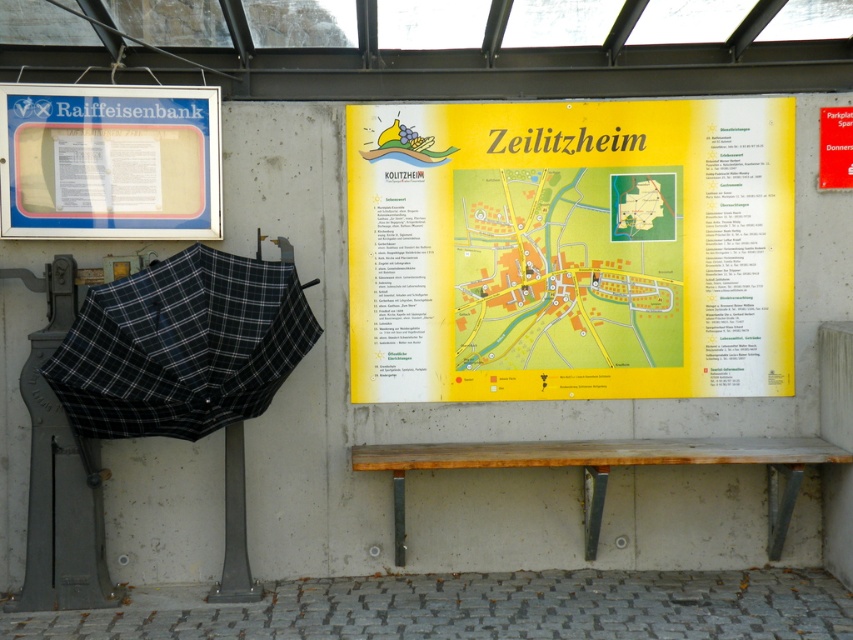
You are standing at the bus stop and need to locate the yellow paper map at upper center and the yellow paper map at center. Which one is higher up?

The yellow paper map at upper center is much taller than the yellow paper map at center, so it is higher up.

You are a tourist holding a yellow paper map at center and want to sit down to consult it. Is the wooden bench at lower center positioned in a way that allows you to sit and still see the map clearly?

The yellow paper map at center is located above the wooden bench at lower center, so you can sit on the bench and easily view the map above you.

You are standing at the bus stop and want to know which point is closer to you. The points are labeled as point 1 at coordinates (495, 243) and point 2 at (466, 221). Which point is nearer to your position?

Point 2 at (466, 221) is closer to you because it is nearer to the camera compared to point 1 at (495, 243).